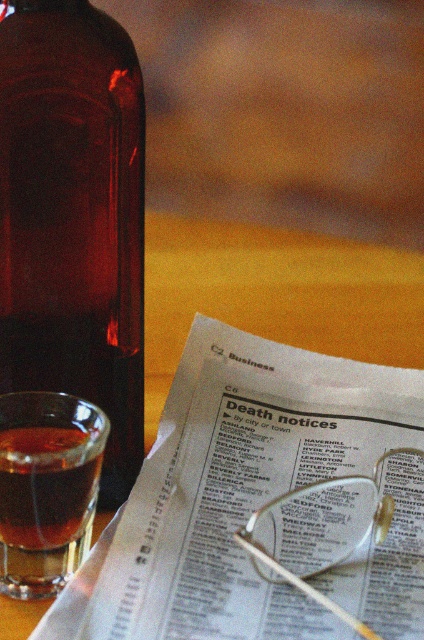
Question: Which object is the closest to the white glossy newspaper at center?

Choices:
 (A) translucent amber glass at left
 (B) brown glass bottle at left

Answer: (A)

Question: Is brown glass bottle at left closer to the viewer compared to translucent amber glass at left?

Choices:
 (A) yes
 (B) no

Answer: (B)

Question: Which point appears closest to the camera in this image?

Choices:
 (A) (58, 346)
 (B) (94, 417)
 (C) (415, 588)

Answer: (C)

Question: Considering the real-world distances, which object is farthest from the white glossy newspaper at center?

Choices:
 (A) brown glass bottle at left
 (B) translucent amber glass at left

Answer: (A)

Question: Considering the relative positions of white glossy newspaper at center and translucent amber glass at left in the image provided, where is white glossy newspaper at center located with respect to translucent amber glass at left?

Choices:
 (A) left
 (B) right

Answer: (B)

Question: Does white glossy newspaper at center appear on the left side of brown glass bottle at left?

Choices:
 (A) no
 (B) yes

Answer: (A)